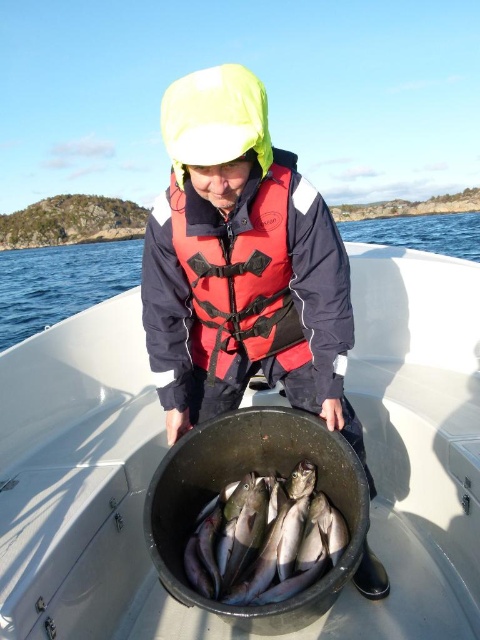
You are a safety inspector checking the proper placement of the life jacket. Based on the scene, is the matte black jacket at center blocking the red matte life jacket at center from being easily accessible?

The matte black jacket at center is in front of the red matte life jacket at center, so it is blocking the life jacket and making it less accessible.